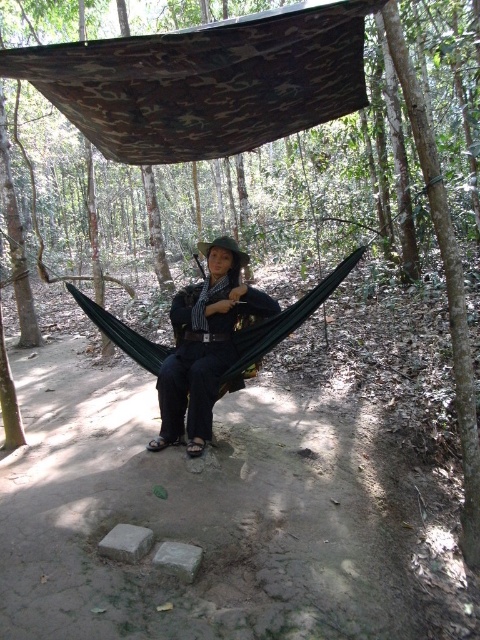
Which is behind, point (252, 28) or point (183, 307)?

Point (183, 307)

Who is positioned more to the left, camo fabric hammock at upper center or dark blue fabric hammock at center?

Positioned to the left is camo fabric hammock at upper center.

Is point (233, 67) behind point (195, 433)?

No, it is not.

Where is `camo fabric hammock at upper center`? camo fabric hammock at upper center is located at coordinates (205, 81).